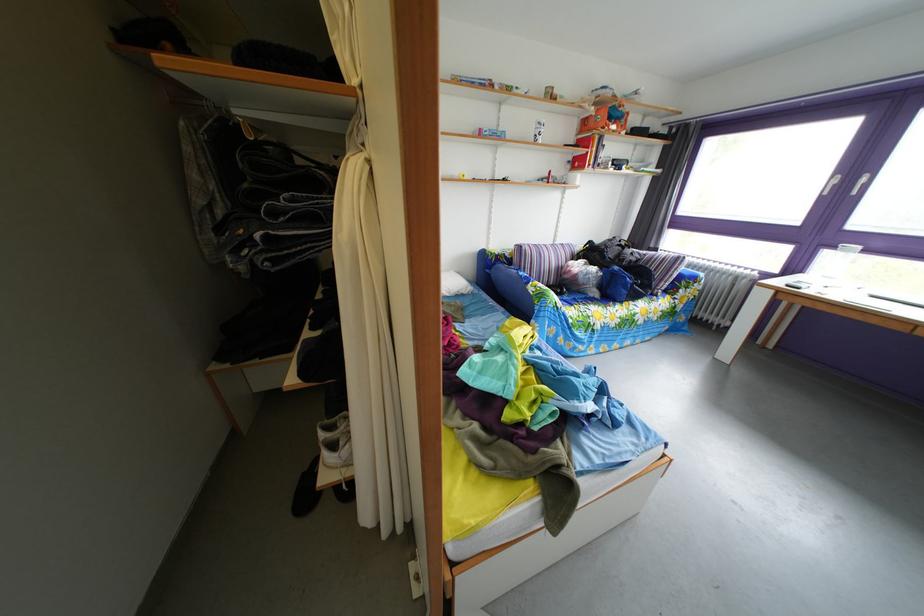
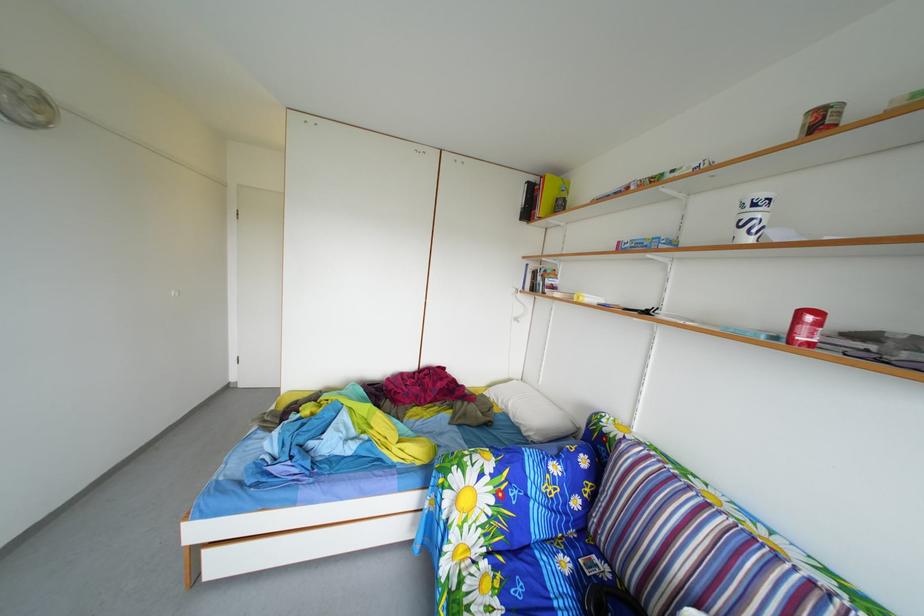
Where in the second image is the point corresponding to (x=568, y=315) from the first image?

(453, 507)